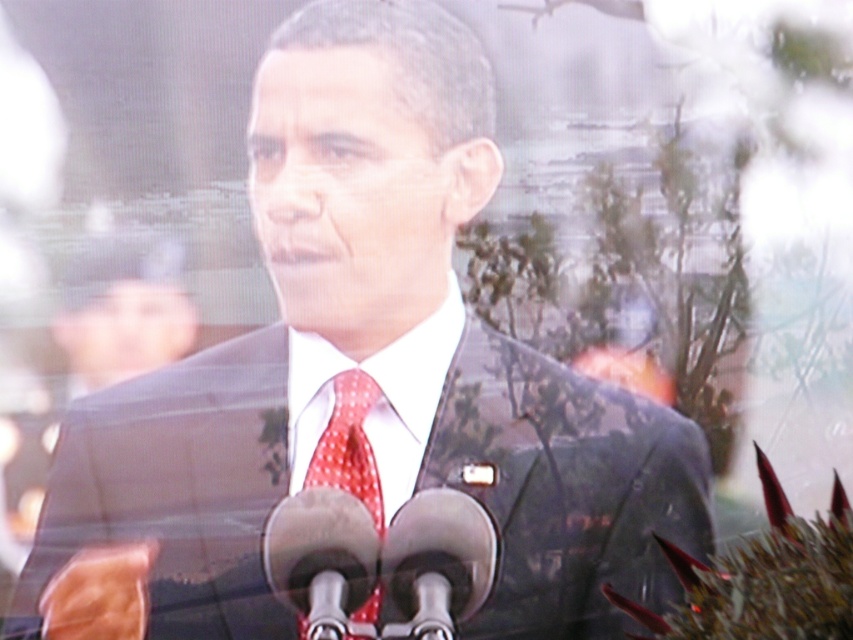
Question: Is metallic silver microphone at center further to camera compared to red dotted fabric tie at center?

Choices:
 (A) yes
 (B) no

Answer: (B)

Question: Which point is closer to the camera?

Choices:
 (A) (412, 554)
 (B) (367, 381)

Answer: (B)

Question: Is metallic silver microphone at center behind red dotted fabric tie at center?

Choices:
 (A) yes
 (B) no

Answer: (B)

Question: Can you confirm if metallic silver microphone at center is smaller than red dotted fabric tie at center?

Choices:
 (A) no
 (B) yes

Answer: (A)